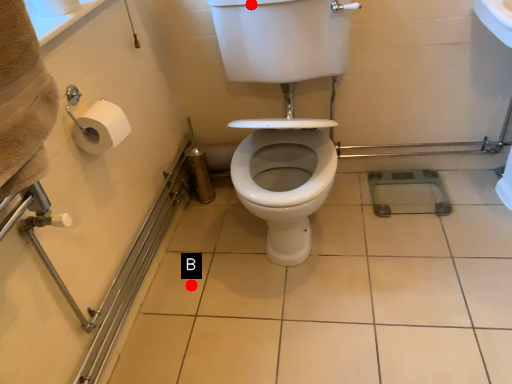
Question: Two points are circled on the image, labeled by A and B beside each circle. Which point is closer to the camera?

Choices:
 (A) A is closer
 (B) B is closer

Answer: (A)